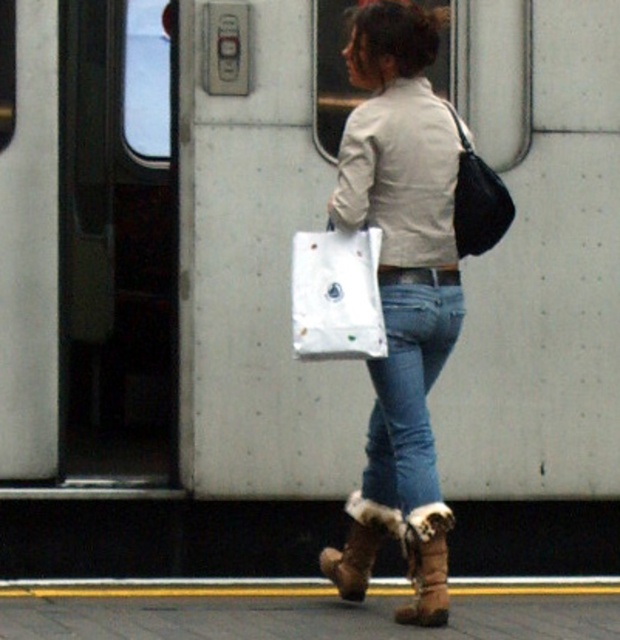
Question: Does jeans at center lie behind brown fuzzy boot at lower center?

Choices:
 (A) yes
 (B) no

Answer: (B)

Question: Does denim jeans at center have a smaller size compared to jeans at center?

Choices:
 (A) no
 (B) yes

Answer: (A)

Question: Which point is closer to the camera?

Choices:
 (A) (443, 348)
 (B) (317, 282)

Answer: (B)

Question: Which object is the farthest from the brown suede boot at lower center?

Choices:
 (A) denim jeans at center
 (B) white paper bag at center

Answer: (B)

Question: Observing the image, what is the correct spatial positioning of jeans at center in reference to brown fuzzy boot at lower center?

Choices:
 (A) below
 (B) above

Answer: (B)

Question: Which of these objects is positioned farthest from the white paper bag at center?

Choices:
 (A) brown suede boot at lower center
 (B) brown fuzzy boot at lower center

Answer: (A)